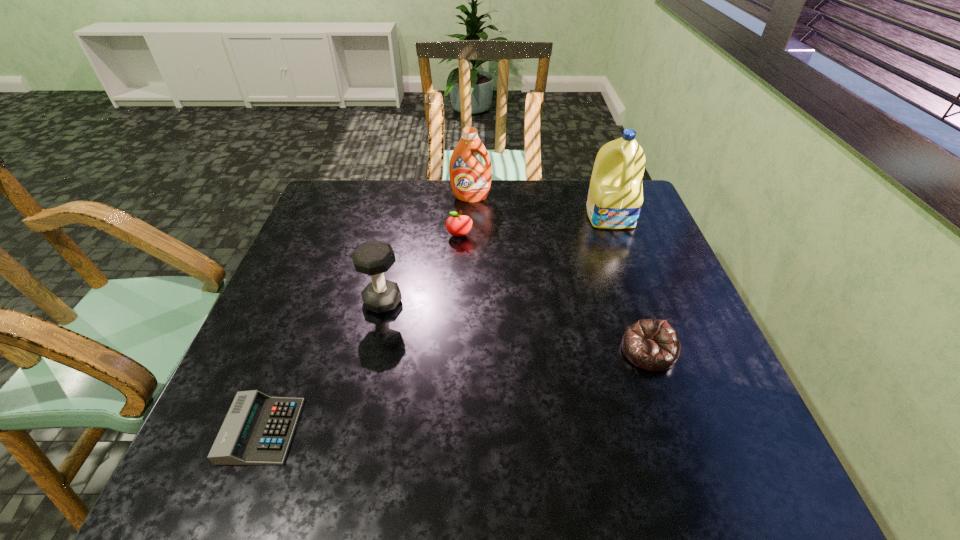
Identify the location of detergent that is at the right edge. (615, 197).

You are a GUI agent. You are given a task and a screenshot of the screen. Output one action in this format:
    pyautogui.click(x=<x>, y=<y>)
    Task: Click on the beanbag that is at the right edge
    This screenshot has width=960, height=540.
    Given the screenshot: What is the action you would take?
    pyautogui.click(x=652, y=344)

Locate an element on the screen. The image size is (960, 540). object at the near left corner is located at coordinates (258, 429).

The image size is (960, 540). Identify the location of object that is at the far right corner. (615, 197).

This screenshot has width=960, height=540. In the image, there is a desktop. Find the location of `blank space at the far edge`. blank space at the far edge is located at coordinates (392, 190).

This screenshot has height=540, width=960. In the image, there is a desktop. In order to click on vacant space at the near edge in this screenshot , I will do `click(467, 463)`.

Image resolution: width=960 pixels, height=540 pixels. Identify the location of free space at the left edge of the desktop. (323, 305).

Where is `vacant region at the right edge of the desktop`? Image resolution: width=960 pixels, height=540 pixels. vacant region at the right edge of the desktop is located at coordinates (604, 240).

At what (x,y) coordinates should I click in order to perform the action: click on blank space at the near right corner of the desktop. Please return your answer as a coordinate pair (x, y). Looking at the image, I should click on (735, 481).

Identify the location of vacant region between the third farthest object and the fifth nearest object. The width and height of the screenshot is (960, 540). (536, 226).